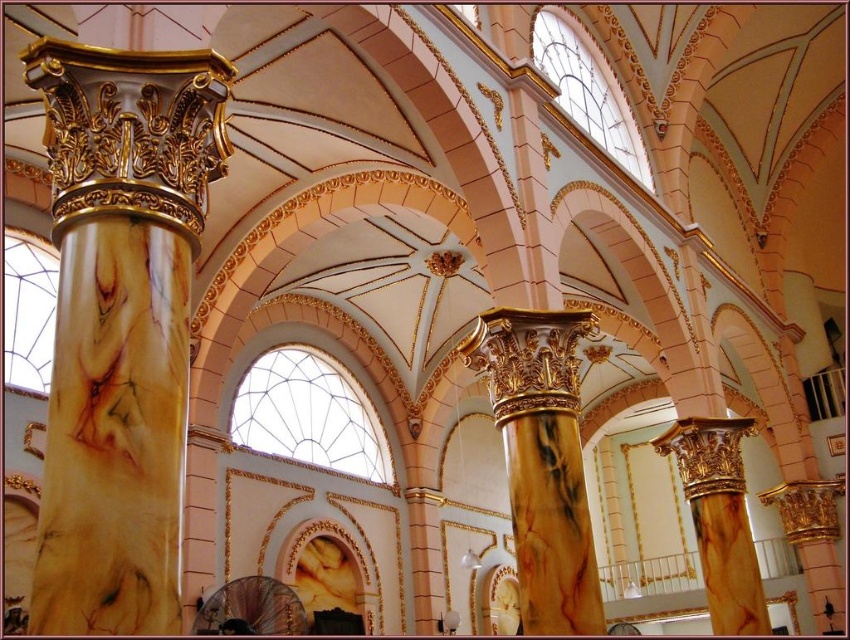
Is point (41, 52) closer to camera compared to point (573, 320)?

That is True.

Where is `marble column at left`? This screenshot has width=850, height=640. marble column at left is located at coordinates (120, 324).

At what (x,y) coordinates should I click in order to perform the action: click on marble column at left. Please return your answer as a coordinate pair (x, y). The image size is (850, 640). Looking at the image, I should click on (120, 324).

How much distance is there between marble column at center and marble column at right?

marble column at center and marble column at right are 22.73 meters apart.

Between marble column at center and marble column at right, which one has more height?

marble column at center

What do you see at coordinates (542, 460) in the screenshot? I see `marble column at center` at bounding box center [542, 460].

This screenshot has height=640, width=850. I want to click on marble column at center, so click(542, 460).

Does marble column at left lie behind marble column at right?

That is False.

Measure the distance from marble column at left to marble column at right.

marble column at left is 46.79 meters away from marble column at right.

You are a GUI agent. You are given a task and a screenshot of the screen. Output one action in this format:
    pyautogui.click(x=<x>, y=<y>)
    Task: Click on the marble column at left
    
    Given the screenshot: What is the action you would take?
    pyautogui.click(x=120, y=324)

Image resolution: width=850 pixels, height=640 pixels. What are the coordinates of `marble column at left` in the screenshot? It's located at (120, 324).